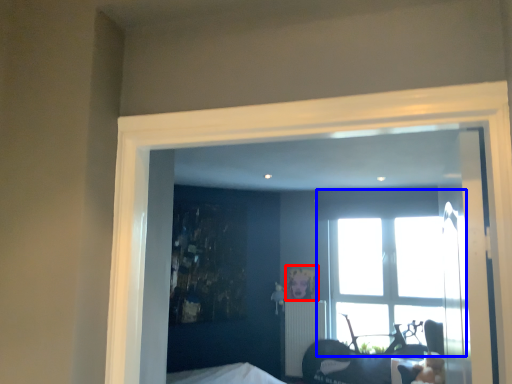
Question: Which of the following is the closest to the observer, picture frame (highlighted by a red box) or window (highlighted by a blue box)?

Choices:
 (A) picture frame
 (B) window

Answer: (B)